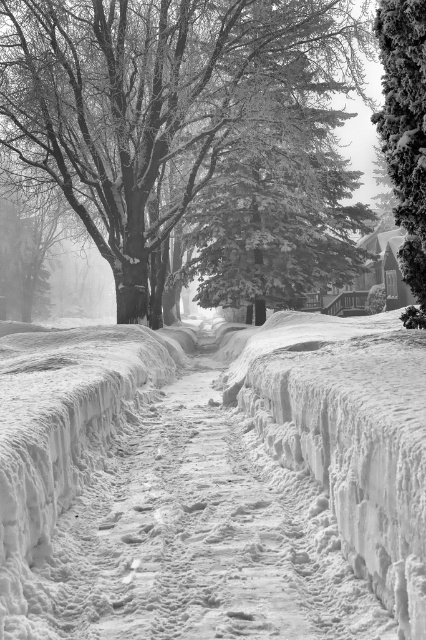
Does snow-covered tree at upper left have a larger size compared to white snow pavement at center?

Yes, snow-covered tree at upper left is bigger than white snow pavement at center.

Can you confirm if snow-covered tree at upper left is positioned above white snow pavement at center?

Correct, snow-covered tree at upper left is located above white snow pavement at center.

Does point (172, 164) come farther from viewer compared to point (100, 595)?

Yes, it is behind point (100, 595).

Find the location of `snow-covered tree at upper left`. snow-covered tree at upper left is located at coordinates (158, 100).

Is snow-covered tree at upper left wider than snow-covered evergreen tree at right?

Correct, the width of snow-covered tree at upper left exceeds that of snow-covered evergreen tree at right.

In the scene shown: Can you confirm if snow-covered tree at upper left is bigger than snow-covered evergreen tree at right?

Indeed, snow-covered tree at upper left has a larger size compared to snow-covered evergreen tree at right.

What do you see at coordinates (158, 100) in the screenshot?
I see `snow-covered tree at upper left` at bounding box center [158, 100].

At what (x,y) coordinates should I click in order to perform the action: click on snow-covered tree at upper left. Please return your answer as a coordinate pair (x, y). This screenshot has width=426, height=640. Looking at the image, I should click on (158, 100).

Does white snow pavement at center have a lesser width compared to snow-covered evergreen tree at right?

No, white snow pavement at center is not thinner than snow-covered evergreen tree at right.

Who is more forward, (118, 529) or (419, 134)?

Point (118, 529) is more forward.

Between point (342, 564) and point (414, 40), which one is positioned behind?

The point (414, 40) is behind.

At what (x,y) coordinates should I click in order to perform the action: click on white snow pavement at center. Please return your answer as a coordinate pair (x, y). Looking at the image, I should click on (195, 540).